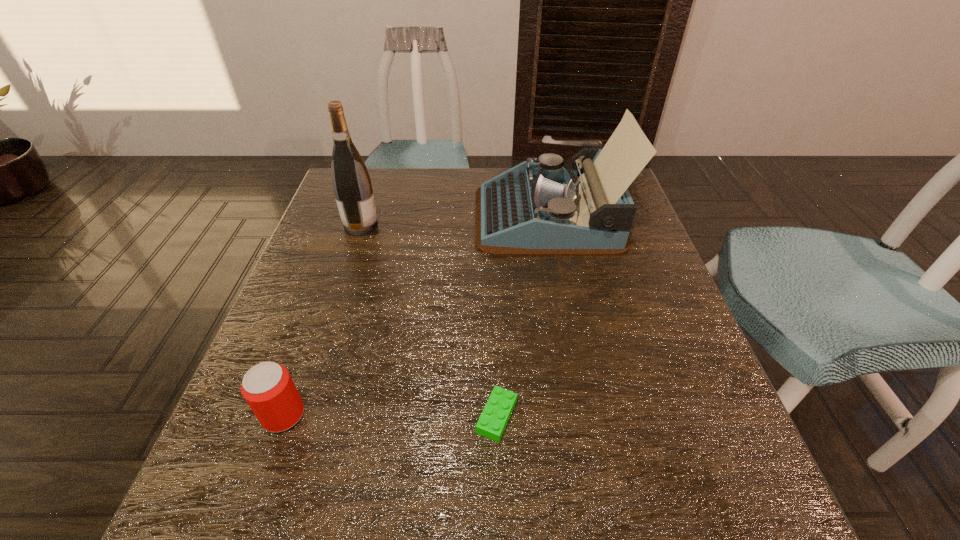
Identify the location of the tallest object. The width and height of the screenshot is (960, 540). (351, 183).

I want to click on typewriter, so click(x=534, y=209).

This screenshot has width=960, height=540. What are the coordinates of `beer can` in the screenshot? It's located at point(268,388).

Identify the location of Lego. pyautogui.click(x=498, y=409).

The width and height of the screenshot is (960, 540). I want to click on vacant space situated 0.050m on the label of the wine bottle, so click(x=397, y=226).

Find the location of `free space located on the typing side of the typewriter`. free space located on the typing side of the typewriter is located at coordinates (360, 215).

Locate an element on the screen. The width and height of the screenshot is (960, 540). vacant space situated 0.300m on the typing side of the typewriter is located at coordinates coord(364,215).

I want to click on free space located 0.110m on the typing side of the typewriter, so click(434, 215).

Identify the location of blank area located on the right of the beer can. (433, 415).

You are a GUI agent. You are given a task and a screenshot of the screen. Output one action in this format:
    pyautogui.click(x=<x>, y=<y>)
    Task: Click on the vacant area located 0.050m on the right of the shortest object
    The width and height of the screenshot is (960, 540).
    Given the screenshot: What is the action you would take?
    pyautogui.click(x=547, y=416)